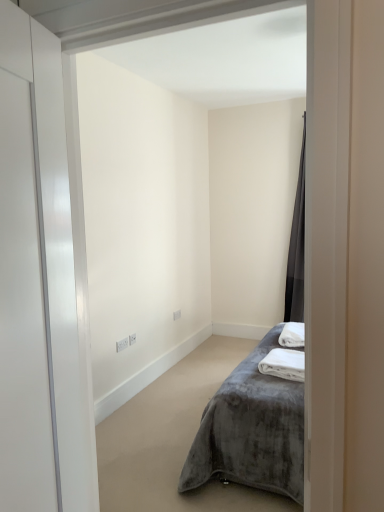
The image size is (384, 512). In order to click on vacant space situated above white soft towel at lower right, the 1th bath towel from the front (from a real-world perspective) in this screenshot , I will do `click(289, 355)`.